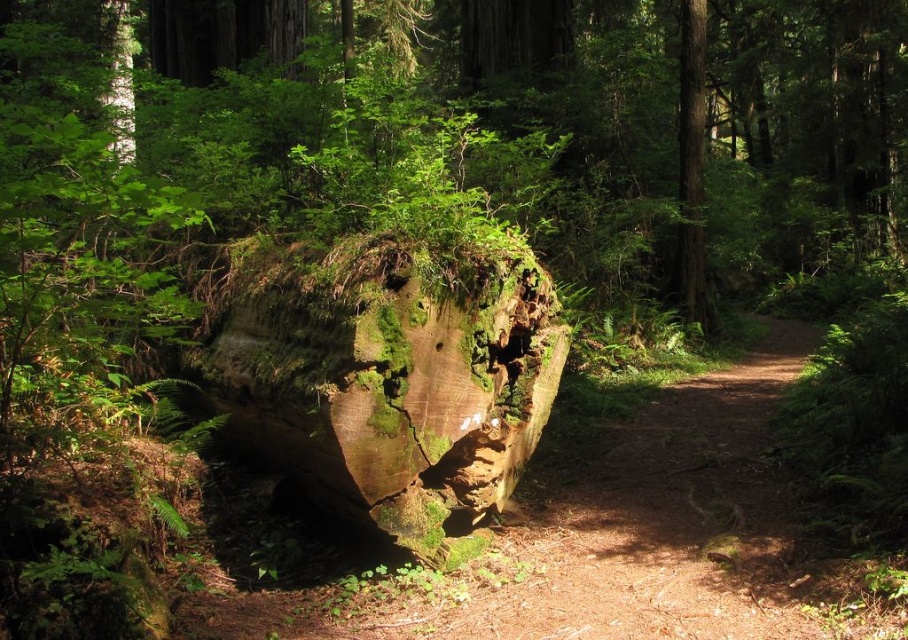
Question: Does green mossy wood at center have a greater width compared to smooth brown tree trunk at center?

Choices:
 (A) yes
 (B) no

Answer: (A)

Question: Is green mossy wood at center to the right of smooth brown tree trunk at center from the viewer's perspective?

Choices:
 (A) no
 (B) yes

Answer: (A)

Question: Which point is closer to the camera?

Choices:
 (A) smooth brown tree trunk at center
 (B) green mossy wood at center

Answer: (B)

Question: Does green mossy wood at center appear over smooth brown tree trunk at center?

Choices:
 (A) yes
 (B) no

Answer: (B)

Question: Among these points, which one is farthest from the camera?

Choices:
 (A) (346, 426)
 (B) (706, 292)

Answer: (B)

Question: Among these points, which one is farthest from the camera?

Choices:
 (A) (341, 308)
 (B) (689, 145)

Answer: (B)